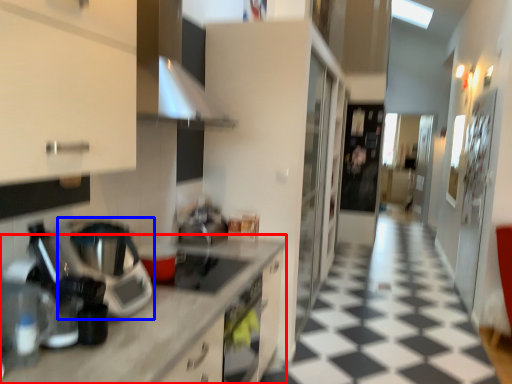
Question: Which of the following is the closest to the observer, countertop (highlighted by a red box) or home appliance (highlighted by a blue box)?

Choices:
 (A) countertop
 (B) home appliance

Answer: (A)